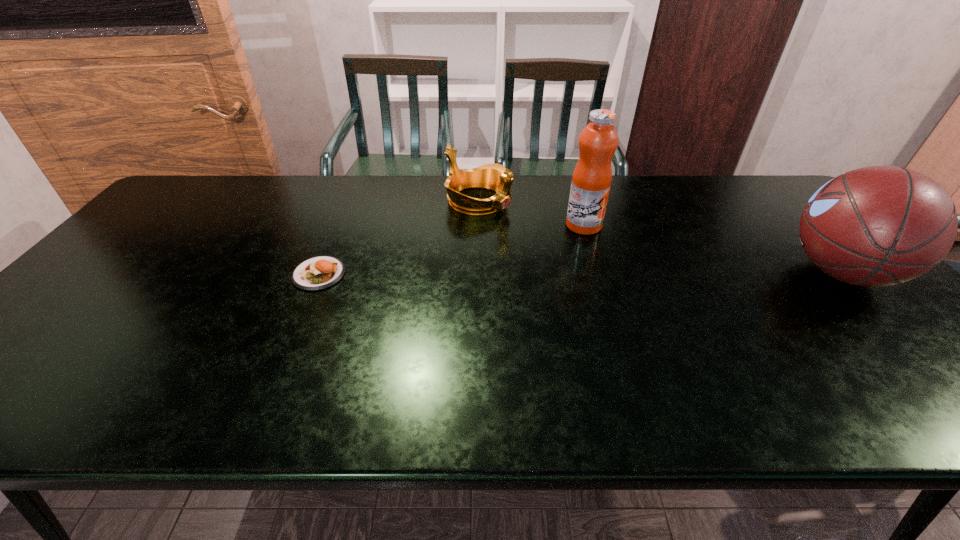
Image resolution: width=960 pixels, height=540 pixels. I want to click on free space at the left edge, so click(91, 328).

You are a GUI agent. You are given a task and a screenshot of the screen. Output one action in this format:
    pyautogui.click(x=<x>, y=<y>)
    Task: Click on the free space at the right edge of the desktop
    
    Given the screenshot: What is the action you would take?
    pyautogui.click(x=798, y=228)

The width and height of the screenshot is (960, 540). Identify the location of vacant position at the far left corner of the desktop. (205, 175).

Locate an element on the screen. vacant space at the far right corner of the desktop is located at coordinates (778, 210).

Image resolution: width=960 pixels, height=540 pixels. Find the location of `free spot between the basketball and the second object from left to right`. free spot between the basketball and the second object from left to right is located at coordinates (660, 236).

Identify the location of vacant region between the shortest object and the basketball. The image size is (960, 540). (580, 273).

Image resolution: width=960 pixels, height=540 pixels. Find the location of `empty space that is in between the patty (food) and the third object from right to left`. empty space that is in between the patty (food) and the third object from right to left is located at coordinates (398, 237).

This screenshot has height=540, width=960. In order to click on free space between the fruit juice and the shortest object in this screenshot , I will do `click(451, 250)`.

The width and height of the screenshot is (960, 540). Find the location of `empty location between the patty (food) and the fruit juice`. empty location between the patty (food) and the fruit juice is located at coordinates (451, 250).

At what (x,y) coordinates should I click in order to perform the action: click on empty space between the second tallest object and the leftmost object. Please return your answer as a coordinate pair (x, y). Looking at the image, I should click on (580, 273).